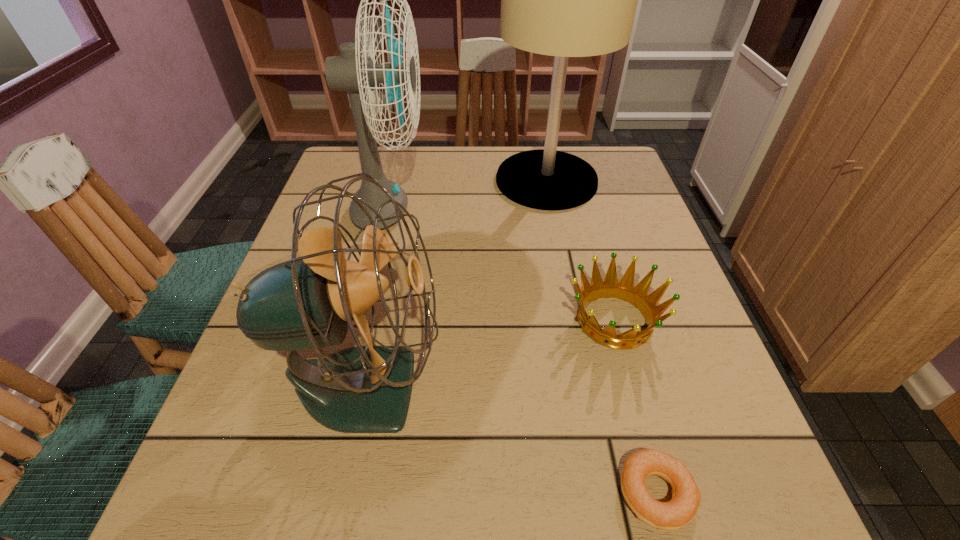
Find the location of a particular element. vacant region located on the back of the bagel is located at coordinates (612, 328).

The height and width of the screenshot is (540, 960). In order to click on table lamp present at the far edge in this screenshot , I will do `click(565, 0)`.

Identify the location of fan that is at the far edge. (356, 73).

The height and width of the screenshot is (540, 960). I want to click on fan at the near edge, so click(x=308, y=302).

Where is `bagel that is at the near edge`? The height and width of the screenshot is (540, 960). bagel that is at the near edge is located at coordinates (682, 508).

The width and height of the screenshot is (960, 540). What are the coordinates of `table lamp that is at the right edge` in the screenshot? It's located at (565, 0).

This screenshot has height=540, width=960. I want to click on crown that is positioned at the right edge, so click(x=638, y=296).

Identify the location of bagel situated at the right edge. The image size is (960, 540). (682, 508).

Where is `object at the far left corner`? object at the far left corner is located at coordinates 356,73.

Locate an element on the screen. object at the near left corner is located at coordinates (308, 302).